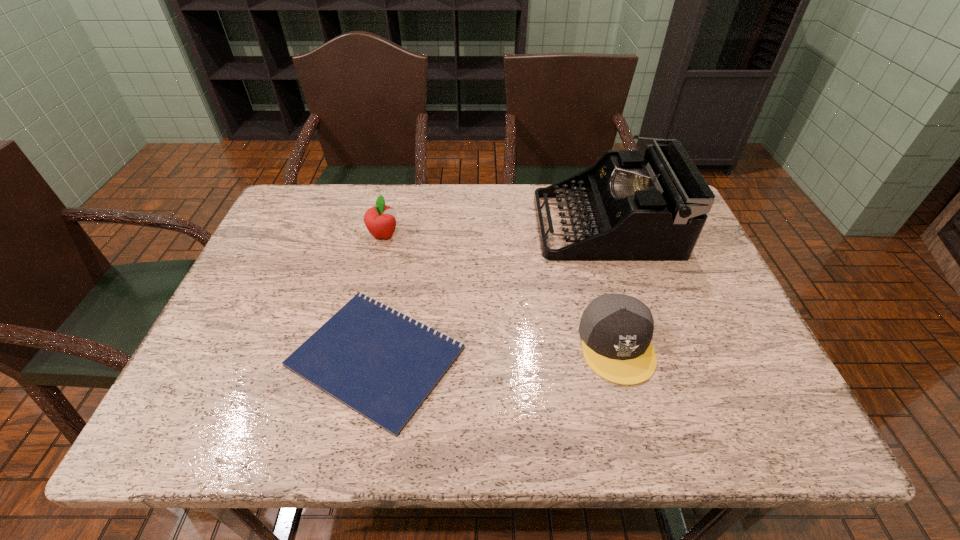
I want to click on typewriter that is at the far edge, so click(653, 208).

Where is `apple positioned at the far edge`? apple positioned at the far edge is located at coordinates (380, 220).

This screenshot has height=540, width=960. Find the location of `object positioned at the near edge`. object positioned at the near edge is located at coordinates (381, 363).

Where is `object at the right edge`? The image size is (960, 540). object at the right edge is located at coordinates (653, 208).

Locate an element on the screen. The width and height of the screenshot is (960, 540). object located at the far right corner is located at coordinates (653, 208).

At what (x,y) coordinates should I click in order to perform the action: click on free space at the far edge. Please return your answer as a coordinate pair (x, y). Looking at the image, I should click on (370, 195).

Locate an element on the screen. This screenshot has width=960, height=540. vacant space at the near edge of the desktop is located at coordinates [338, 418].

You are a GUI agent. You are given a task and a screenshot of the screen. Output one action in this format:
    pyautogui.click(x=<x>, y=<y>)
    Task: Click on the vacant space at the left edge of the desktop
    This screenshot has width=960, height=540.
    Given the screenshot: What is the action you would take?
    pyautogui.click(x=288, y=241)

Where is `free region at the right edge of the desktop`? This screenshot has height=540, width=960. free region at the right edge of the desktop is located at coordinates (668, 268).

Find the location of a particular element. Image resolution: width=960 pixels, height=540 pixels. vacant space at the far left corner of the desktop is located at coordinates (322, 187).